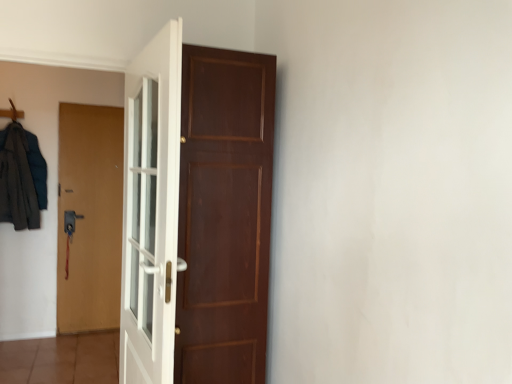
The image size is (512, 384). I want to click on free location in front of brown matte door at left, acting as the 1th door starting from the left, so click(x=75, y=339).